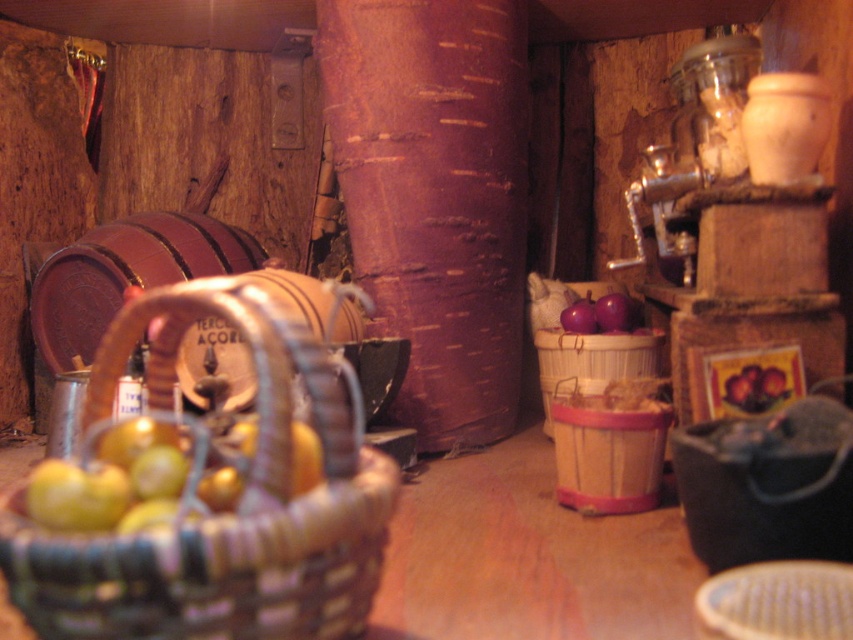
Is woven brown basket at center to the left of purple matte apple at center-right from the viewer's perspective?

Yes, woven brown basket at center is to the left of purple matte apple at center-right.

Describe the element at coordinates (218, 515) in the screenshot. The height and width of the screenshot is (640, 853). I see `woven brown basket at center` at that location.

Is point (33, 584) in front of point (577, 308)?

Yes, point (33, 584) is in front of point (577, 308).

In order to click on woven brown basket at center in this screenshot , I will do `click(218, 515)`.

Is point (653, 368) positioned before point (566, 308)?

Yes, it is.

What do you see at coordinates (590, 362) in the screenshot?
I see `wooden woven basket at center` at bounding box center [590, 362].

Which is in front, point (572, 387) or point (567, 314)?

Point (572, 387) is in front.

I want to click on wooden woven basket at center, so click(590, 362).

Is point (247, 337) closer to viewer compared to point (540, 364)?

Yes, it is.

Between point (129, 564) and point (587, 371), which one is positioned in front?

Point (129, 564)

This screenshot has height=640, width=853. Identify the location of woven brown basket at center. (218, 515).